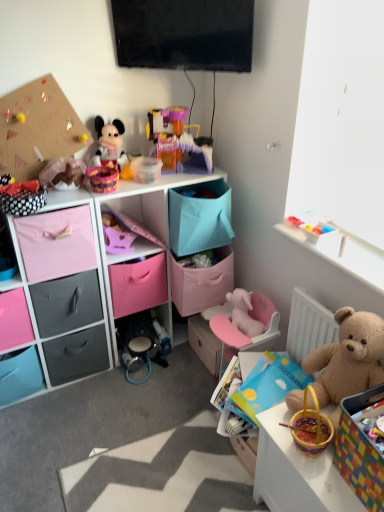
I want to click on free space in front of pink fabric storage unit at center, so click(90, 420).